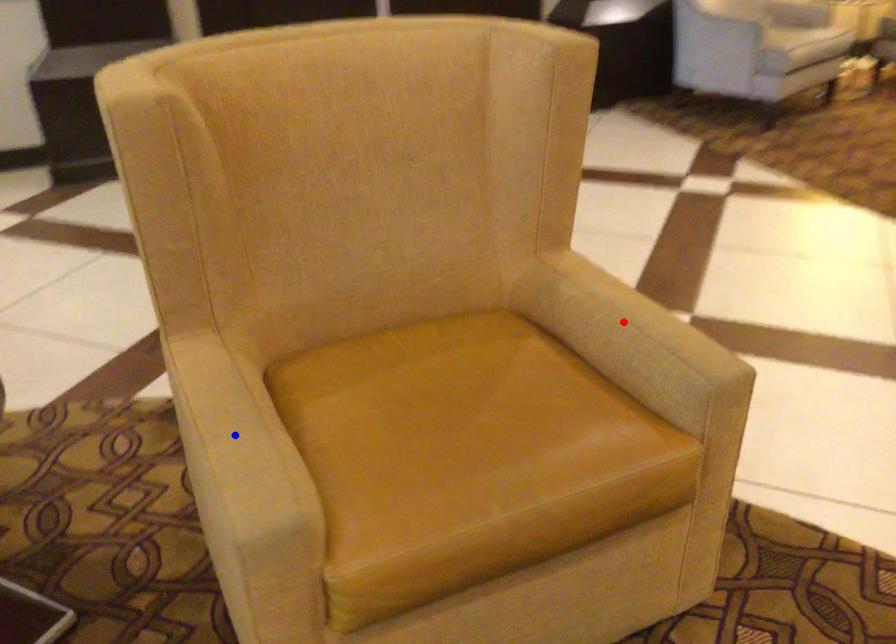
Question: Which of the two points in the image is closer to the camera?

Choices:
 (A) Blue point is closer.
 (B) Red point is closer.

Answer: (A)